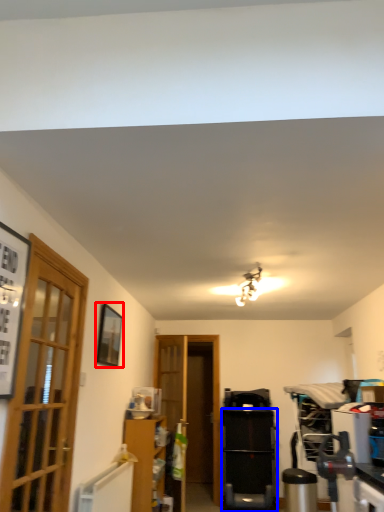
Question: Among these objects, which one is farthest to the camera, picture frame (highlighted by a red box) or appliance (highlighted by a blue box)?

Choices:
 (A) picture frame
 (B) appliance

Answer: (B)